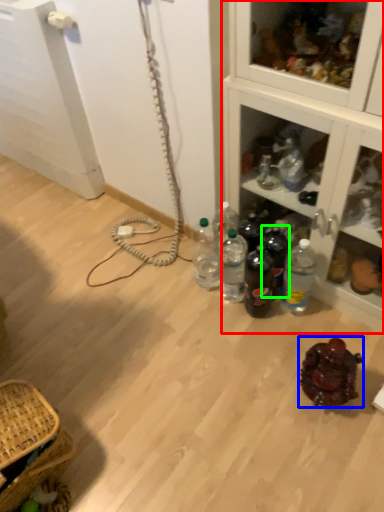
Question: Estimate the real-world distances between objects in this image. Which object is farther from cabinetry (highlighted by a red box), food (highlighted by a blue box) or bottle (highlighted by a green box)?

Choices:
 (A) food
 (B) bottle

Answer: (A)